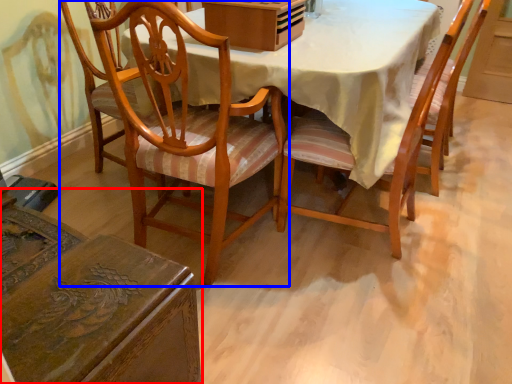
Question: Which of the following is the farthest to the observer, chair (highlighted by a red box) or chair (highlighted by a blue box)?

Choices:
 (A) chair
 (B) chair

Answer: (B)